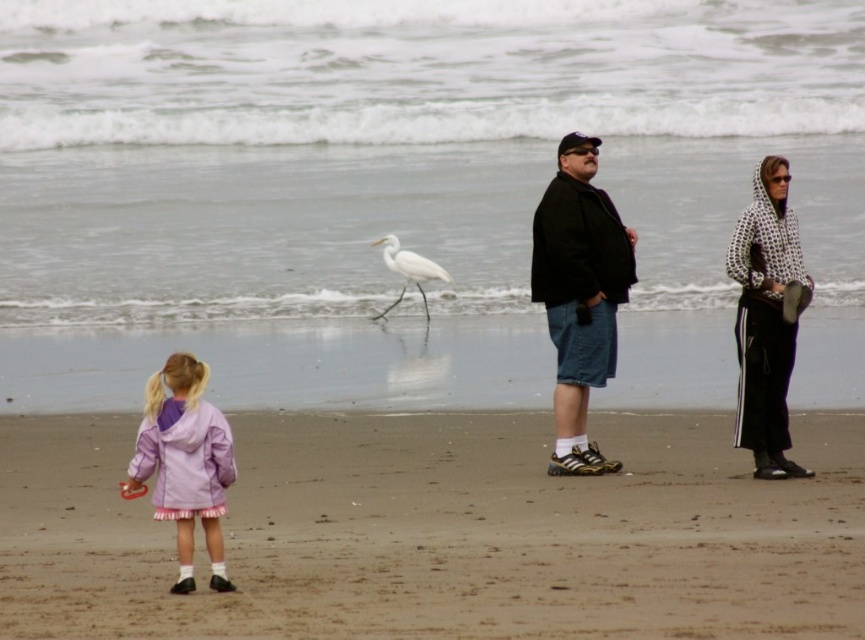
Does light brown sand at lower center have a lesser width compared to purple fleece jacket at lower left?

Yes, light brown sand at lower center is thinner than purple fleece jacket at lower left.

Between light brown sand at lower center and purple fleece jacket at lower left, which one is positioned higher?

purple fleece jacket at lower left is higher up.

Measure the distance between point (455, 589) and camera.

A distance of 10.88 meters exists between point (455, 589) and camera.

I want to click on light brown sand at lower center, so click(441, 532).

Can you confirm if black matte jacket at center is bigger than white dotted hoodie at right?

Yes.

Which is in front, point (569, 269) or point (785, 189)?

Point (785, 189)

This screenshot has width=865, height=640. Identify the location of black matte jacket at center. point(580,294).

Does purple fleece jacket at lower left have a greater width compared to white matte bird at center?

In fact, purple fleece jacket at lower left might be narrower than white matte bird at center.

Consider the image. Between purple fleece jacket at lower left and white matte bird at center, which one appears on the right side from the viewer's perspective?

white matte bird at center

Who is more forward, [193,376] or [388,262]?

Positioned in front is point [193,376].

Find the location of a particular element. purple fleece jacket at lower left is located at coordinates coord(184,461).